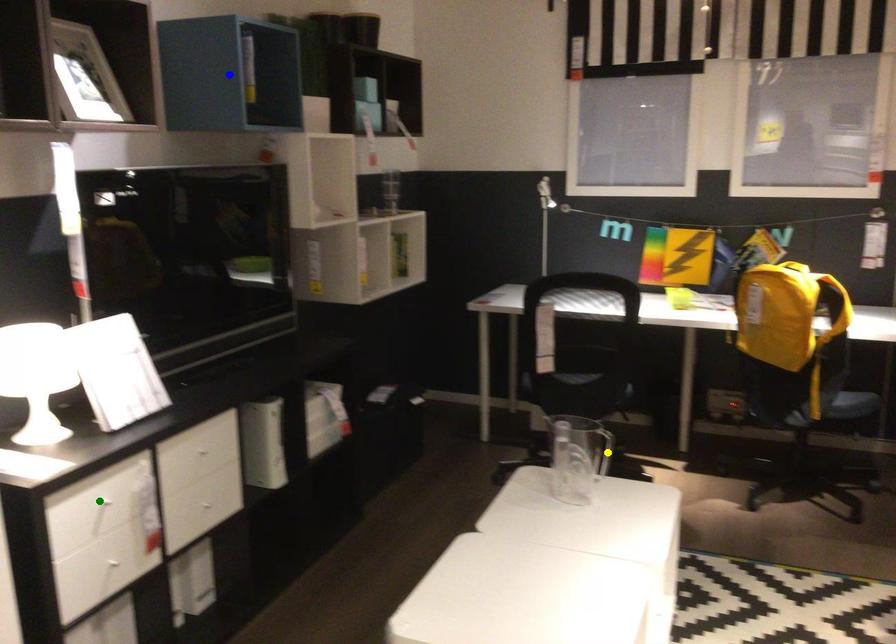
Consider the image. Order these from nearest to farthest:
- green point
- yellow point
- blue point

1. green point
2. blue point
3. yellow point